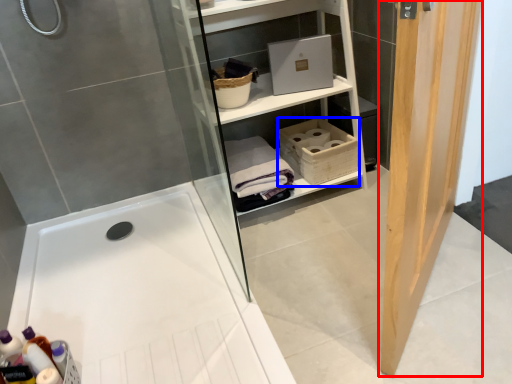
Question: Which point is further to the camera, door (highlighted by a red box) or basket (highlighted by a blue box)?

Choices:
 (A) door
 (B) basket

Answer: (B)